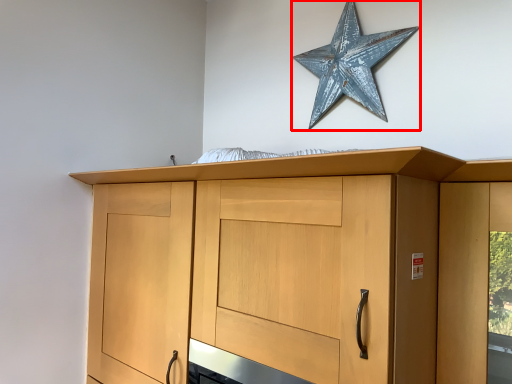
Question: From the image's perspective, where is star (annotated by the red box) located relative to cupboard?

Choices:
 (A) below
 (B) above

Answer: (B)